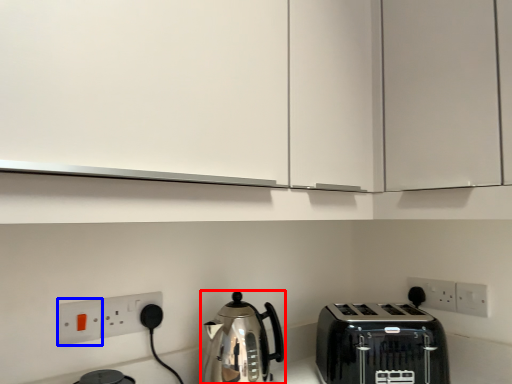
Question: Which of the following is the farthest to the observer, kettle (highlighted by a red box) or electric outlet (highlighted by a blue box)?

Choices:
 (A) kettle
 (B) electric outlet

Answer: (B)